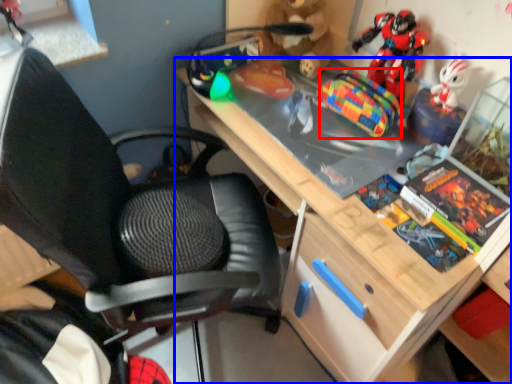
Question: Which object appears closest to the camera in this image, toy (highlighted by a red box) or desk (highlighted by a blue box)?

Choices:
 (A) toy
 (B) desk

Answer: (B)